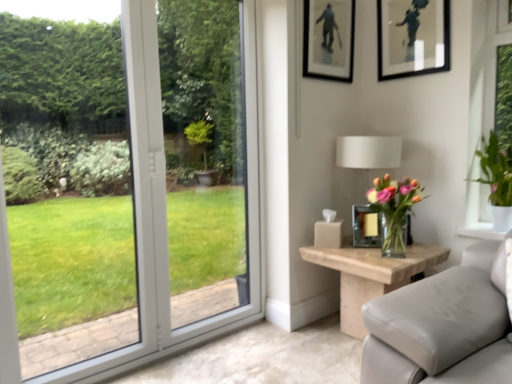
Where is `free space in front of metallic gold picture frame at right, the second picture frame from the left`? This screenshot has width=512, height=384. free space in front of metallic gold picture frame at right, the second picture frame from the left is located at coordinates 371,253.